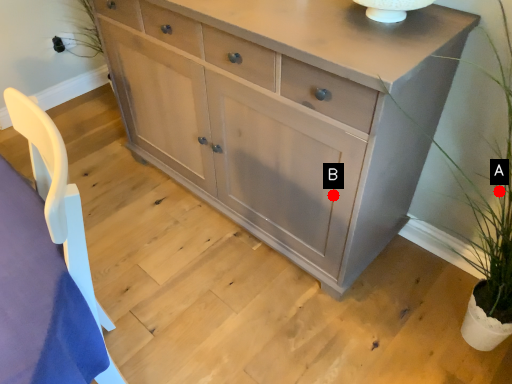
Question: Two points are circled on the image, labeled by A and B beside each circle. Among these points, which one is nearest to the camera?

Choices:
 (A) A is closer
 (B) B is closer

Answer: (A)